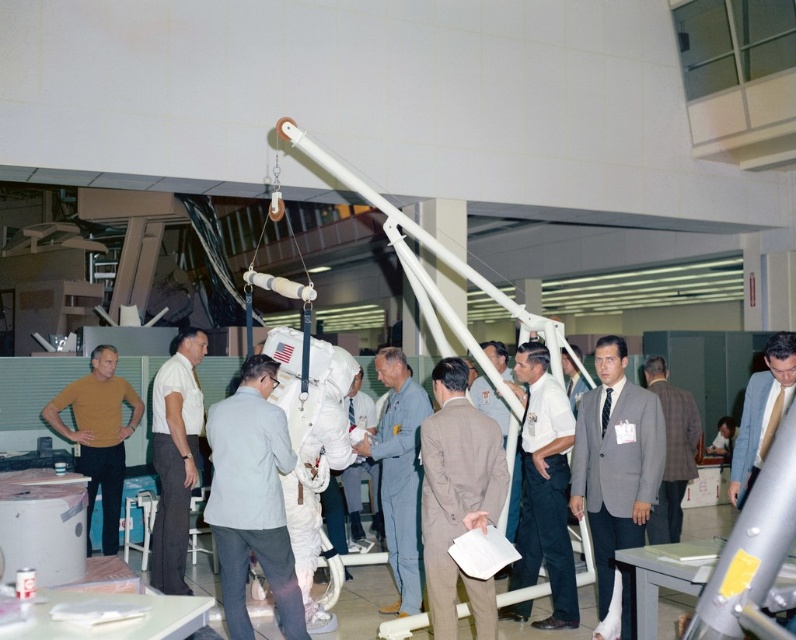
Is point (533, 429) farther from camera compared to point (765, 433)?

Yes.

Which is in front, point (517, 602) or point (751, 436)?

Point (751, 436) is in front.

Find the location of a particular element. The height and width of the screenshot is (640, 796). white shirt at center is located at coordinates (544, 486).

This screenshot has height=640, width=796. In order to click on matte yellow shirt at center in this screenshot , I will do `click(98, 435)`.

Does matte yellow shirt at center have a lesser height compared to light gray suit at center?

Incorrect, matte yellow shirt at center's height does not fall short of light gray suit at center's.

I want to click on matte yellow shirt at center, so click(98, 435).

From the picture: Which is more to the left, light brown suit at center or white cotton shirt at center?

white cotton shirt at center

Does light brown suit at center appear on the left side of white cotton shirt at center?

No, light brown suit at center is not to the left of white cotton shirt at center.

Between point (475, 515) and point (170, 564), which one is positioned behind?

The point (170, 564) is more distant.

You are a GUI agent. You are given a task and a screenshot of the screen. Output one action in this format:
    pyautogui.click(x=<x>, y=<y>)
    Task: Click on the light brown suit at center
    
    Given the screenshot: What is the action you would take?
    pyautogui.click(x=458, y=497)